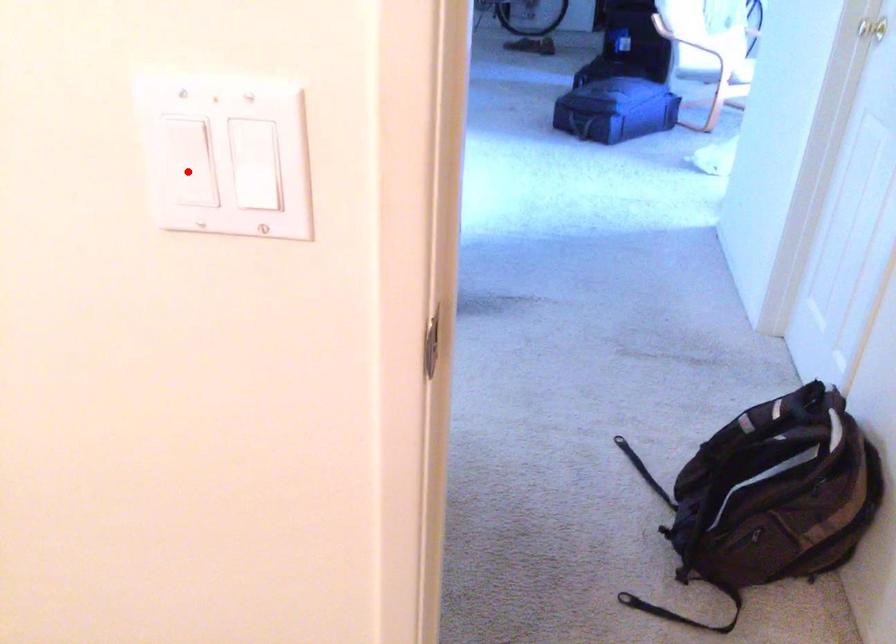
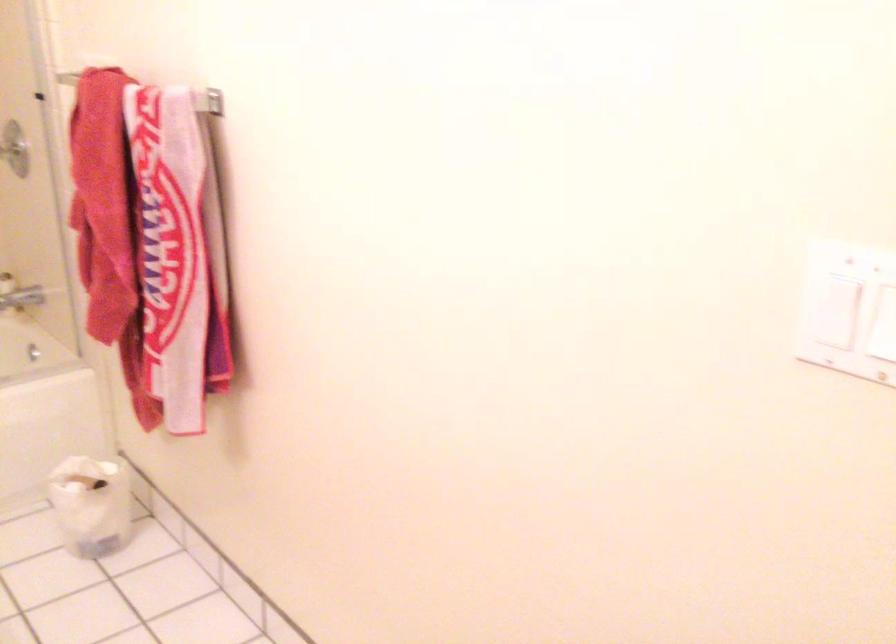
Question: I am providing you with two images of the same scene from different viewpoints. Image1 has a red point marked. In image2, the corresponding 3D location appears at what relative position? Reply with the corresponding letter.

Choices:
 (A) Closer
 (B) Farther

Answer: (B)